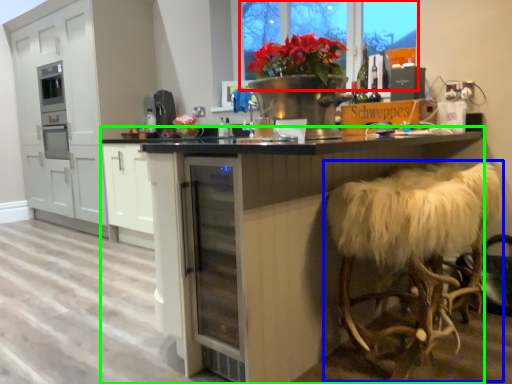
Question: Which object is the farthest from window screen (highlighted by a red box)? Choose among these: swivel chair (highlighted by a blue box) or table (highlighted by a green box).

Choices:
 (A) swivel chair
 (B) table

Answer: (A)